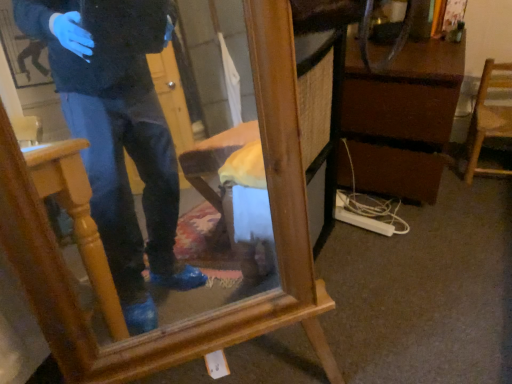
The height and width of the screenshot is (384, 512). Find the location of `spots to the right of wooden mirror at center`. spots to the right of wooden mirror at center is located at coordinates (380, 318).